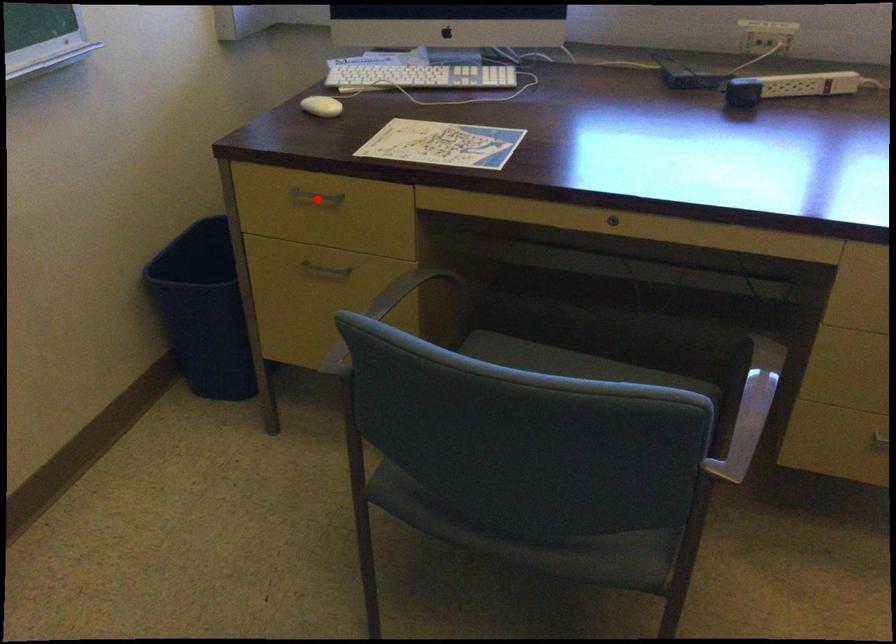
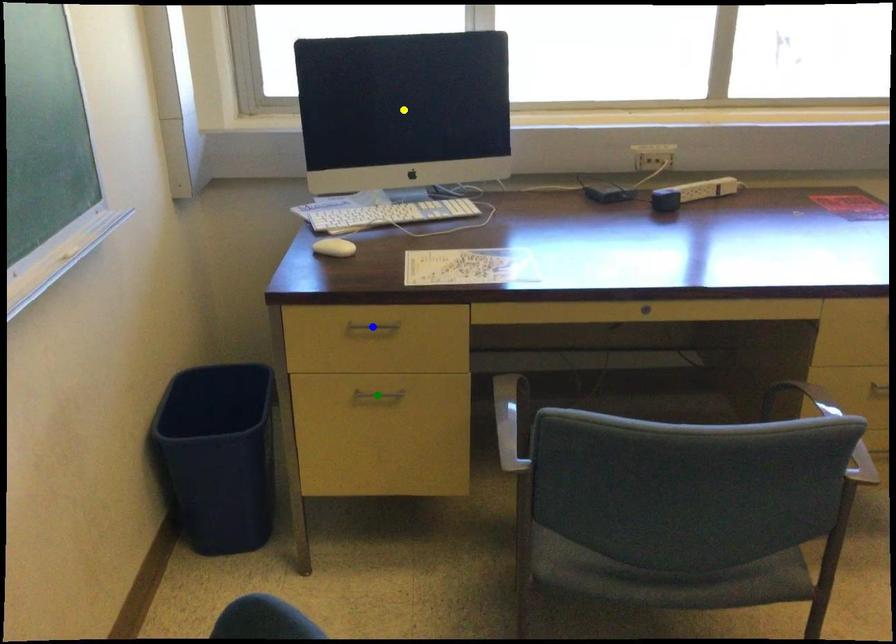
Question: I am providing you with two images of the same scene from different viewpoints. A red point is marked on the first image. You are given multiple points on the second image. Which point in image 2 represents the same 3d spot as the red point in image 1?

Choices:
 (A) yellow point
 (B) green point
 (C) blue point

Answer: (C)